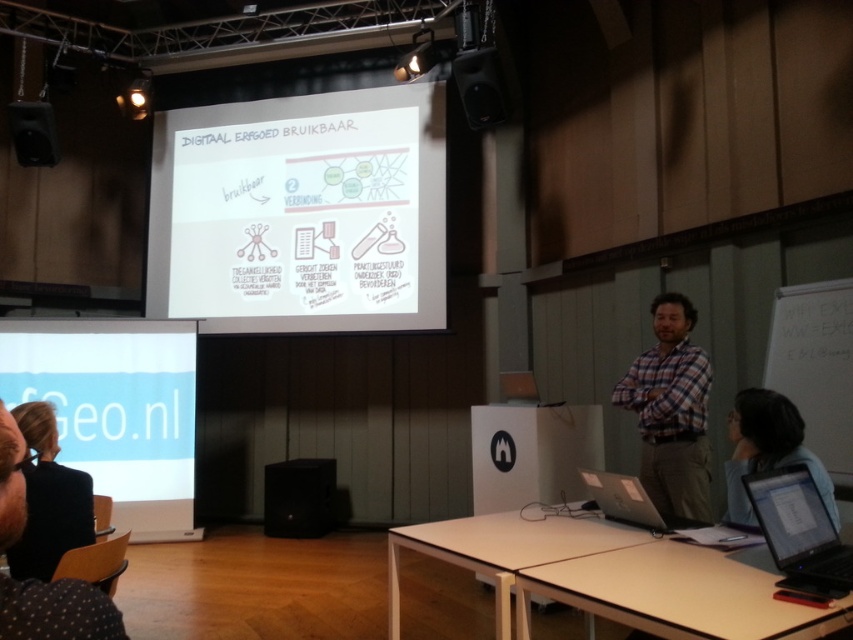
What is the exact coordinate of the dark brown hair at lower left in the image?

The dark brown hair at lower left is located at point (x=49, y=499).

You are an attendee at the presentation and you see the white paper at left and the blue fabric shirt at lower right. Which object is positioned more to the left side of the scene?

The white paper at left is positioned more to the left side of the scene than the blue fabric shirt at lower right.

You are an attendee at the presentation and want to take notes. You see the white paper at center and the black plastic laptop at center. Which object is located to the left of the other?

The white paper at center is positioned on the left side of black plastic laptop at center.